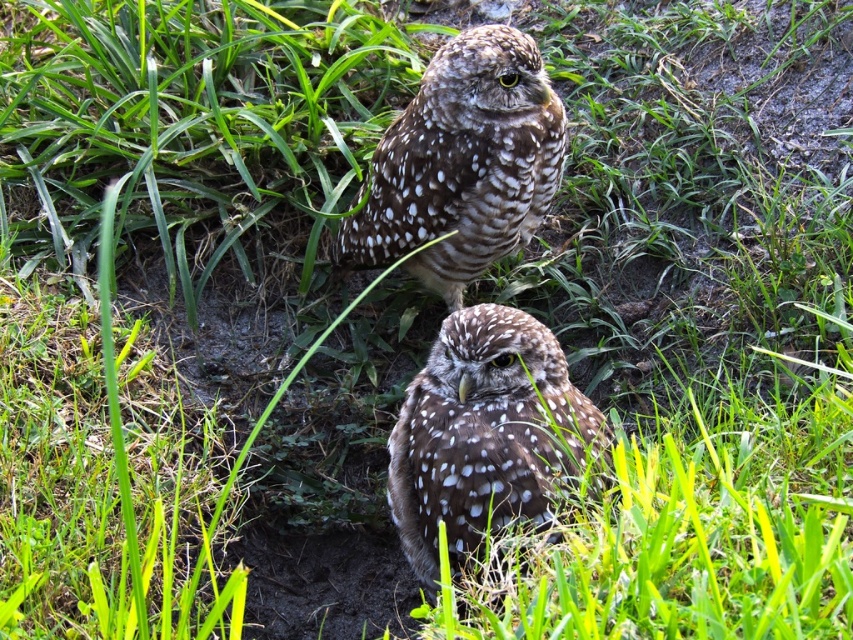
You are a birdwatcher observing two speckled brown owls in a grassy area. You see the speckled brown owl at upper center and the speckled brown owl at center. Which owl is positioned more to the left side of the scene?

The speckled brown owl at upper center is positioned more to the left side of the scene compared to the speckled brown owl at center.

You are a photographer trying to capture a closeup of the Burrowing Owls in the grassy area. You notice two points marked in the scene. Which point, point [451,230] or point [494,376], is closer to your camera lens?

Point [451,230] is further to the camera than point [494,376], so the point closer to the camera lens is point [494,376].